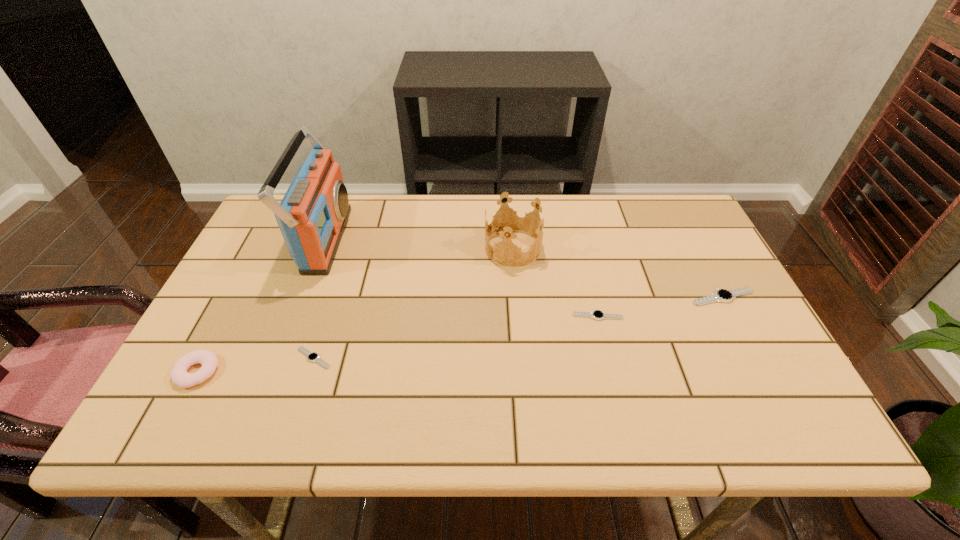
Please determine a free point for an extra watch to ensure balance. Please provide its 2D coordinates. Your answer should be formatted as a tuple, i.e. [(x, y)], where the tuple contains the x and y coordinates of a point satisfying the conditions above.

[(462, 336)]